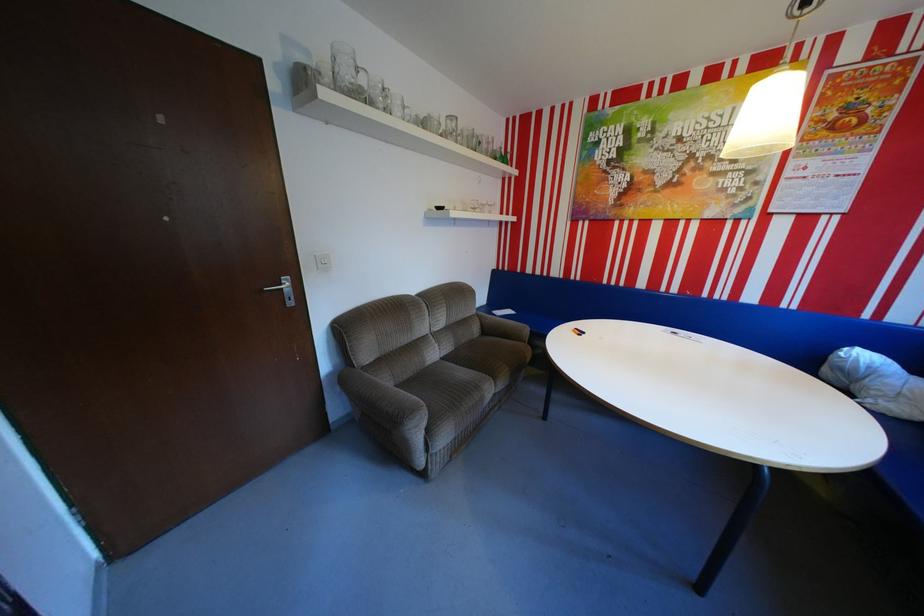
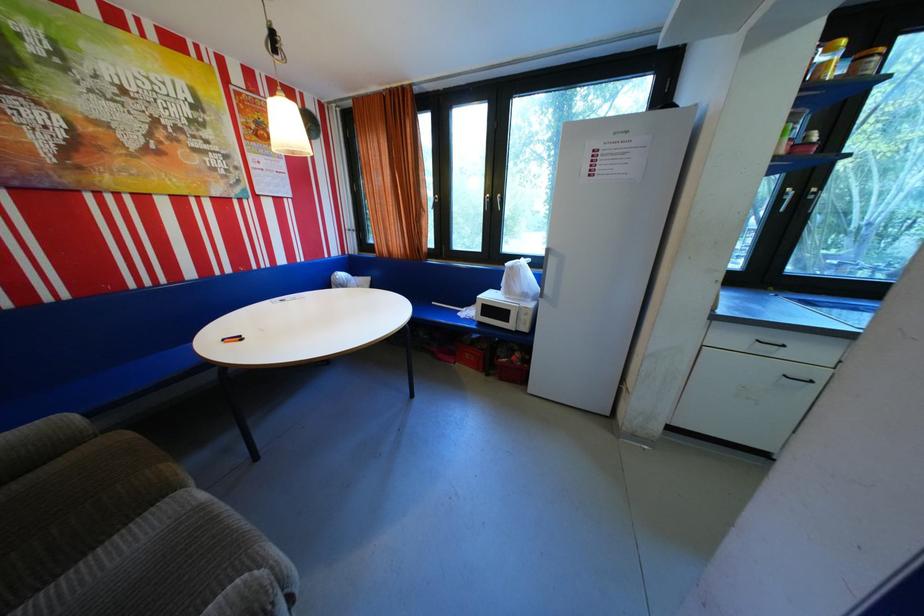
Locate, in the second image, the point that corresponds to pixel 538 328 in the first image.

(79, 418)